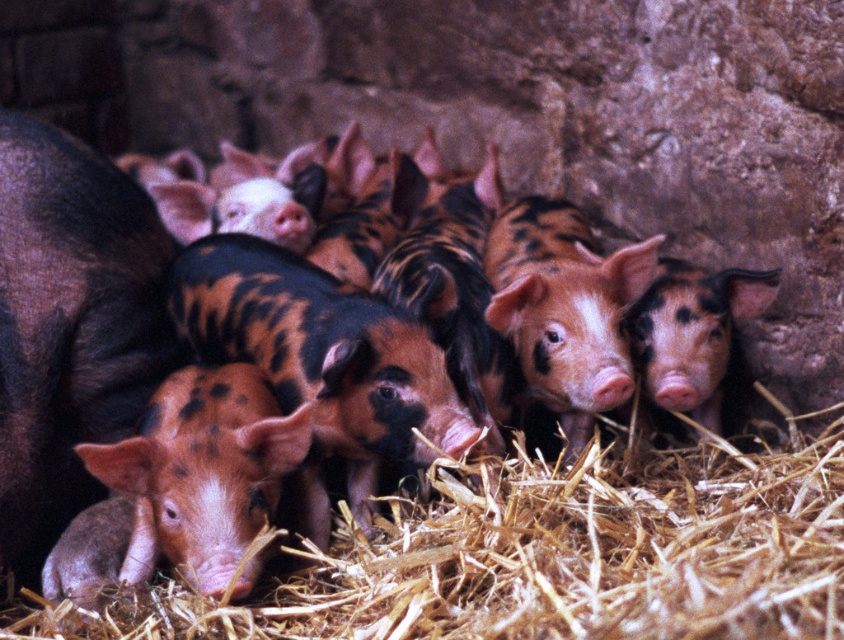
You are standing in the barn and see two points marked in the image. Which point is closer to you, point [534,531] or point [418,161]?

Point [534,531] is in front of point [418,161], so it is closer to you.

You are a farmer checking the piglets in the barn. You need to place a small food bowl between the brown straw at lower left and the spotted pink piglet at center. The bowl has a diameter of 10 inches. Will there be enough space between them to fit the bowl?

The brown straw at lower left is 12.64 inches away from the spotted pink piglet at center. Since the bowl requires 10 inches of space, there is enough space between them to fit the bowl.

You are a farmer who wants to clean the barn. You need to locate the brown straw at lower left. Where exactly is it located?

The brown straw at lower left is located at point (x=545, y=556).